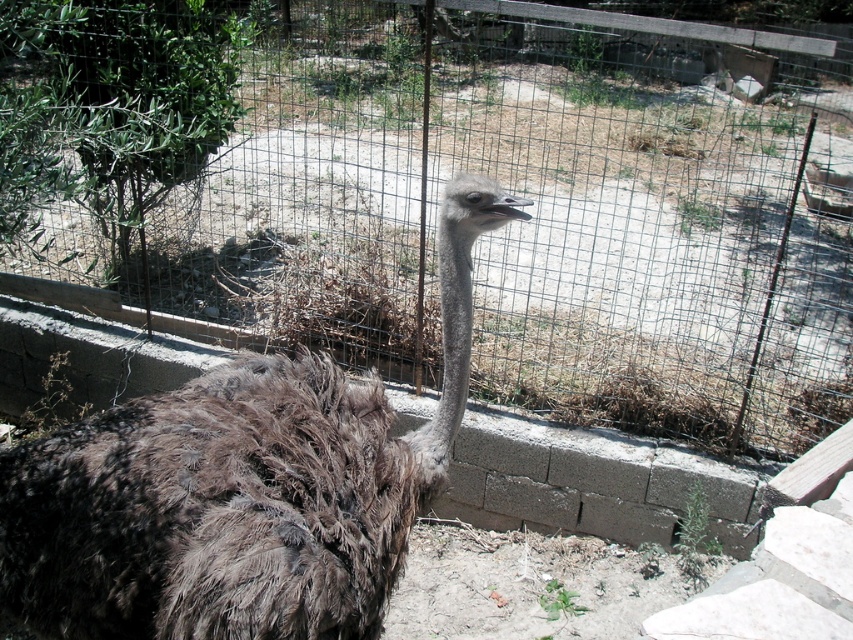
Question: In this image, where is wire mesh fence at center located relative to brown feathered ostrich head at center?

Choices:
 (A) right
 (B) left

Answer: (A)

Question: Which of the following is the farthest from the observer?

Choices:
 (A) (340, 32)
 (B) (445, 237)
 (C) (453, 371)

Answer: (A)

Question: Is wire mesh fence at center wider than brown feathered ostrich head at center?

Choices:
 (A) yes
 (B) no

Answer: (A)

Question: Can you confirm if wire mesh fence at center is positioned to the right of brown fuzzy ostrich at center?

Choices:
 (A) yes
 (B) no

Answer: (A)

Question: Which point appears farthest from the camera in this image?

Choices:
 (A) (850, 316)
 (B) (453, 234)

Answer: (A)

Question: Which of the following is the closest to the observer?

Choices:
 (A) brown feathered ostrich head at center
 (B) brown fuzzy ostrich at center
 (C) wire mesh fence at center

Answer: (B)